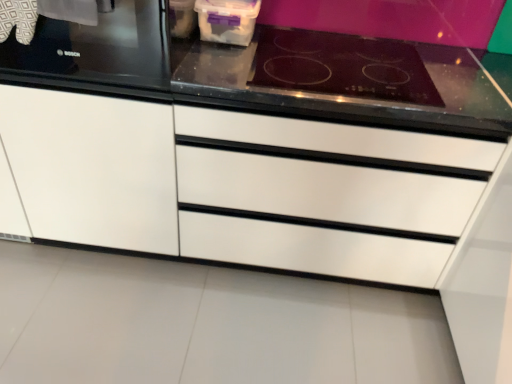
Question: Is white matte cabinet at left wider or thinner than black glass cooktop at upper right?

Choices:
 (A) wide
 (B) thin

Answer: (A)

Question: Considering their positions, is white matte cabinet at left located in front of or behind black glass cooktop at upper right?

Choices:
 (A) behind
 (B) front

Answer: (B)

Question: Estimate the real-world distances between objects in this image. Which object is farther from the black glass cooktop at upper right?

Choices:
 (A) white glossy drawer at center
 (B) black glass stove at upper left
 (C) white matte cabinet at left

Answer: (C)

Question: Which of these objects is positioned farthest from the black glass stove at upper left?

Choices:
 (A) black glass cooktop at upper right
 (B) white glossy drawer at center
 (C) white matte cabinet at left

Answer: (A)